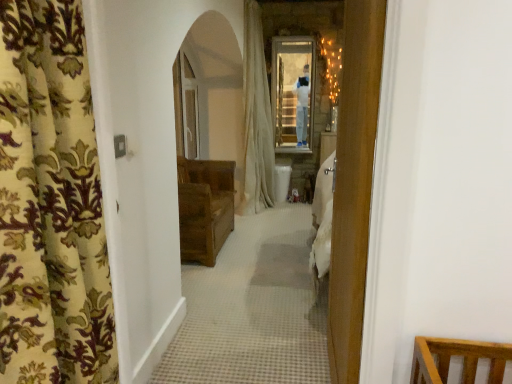
Question: Would you say floral fabric curtain at left, marked as the first curtain in a left-to-right arrangement, is inside or outside white fabric curtain at center, the first curtain from the back?

Choices:
 (A) inside
 (B) outside

Answer: (B)

Question: Does point (17, 377) appear closer or farther from the camera than point (251, 137)?

Choices:
 (A) closer
 (B) farther

Answer: (A)

Question: Which is farther from the white fabric curtain at center, arranged as the first curtain when viewed from the right?

Choices:
 (A) floral fabric curtain at left, marked as the first curtain in a left-to-right arrangement
 (B) brown wooden chest at center

Answer: (A)

Question: Which is nearer to the floral fabric curtain at left, placed as the 1th curtain when sorted from front to back?

Choices:
 (A) white fabric curtain at center, the first curtain from the back
 (B) brown wooden chest at center

Answer: (B)